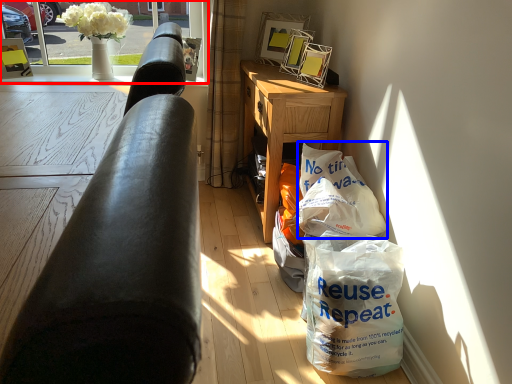
Question: Which object appears farthest to the camera in this image, window screen (highlighted by a red box) or grocery bag (highlighted by a blue box)?

Choices:
 (A) window screen
 (B) grocery bag

Answer: (A)